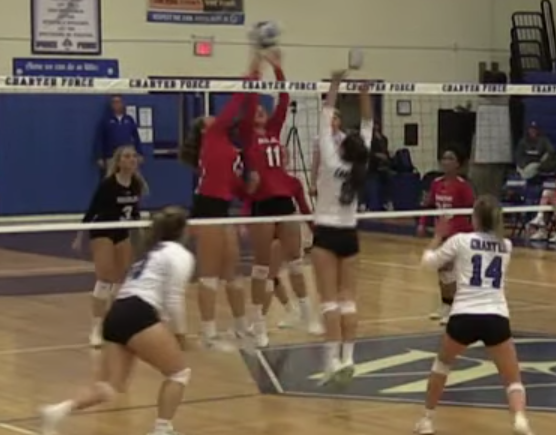
Where is `beige wall`? beige wall is located at coordinates (x=123, y=30).